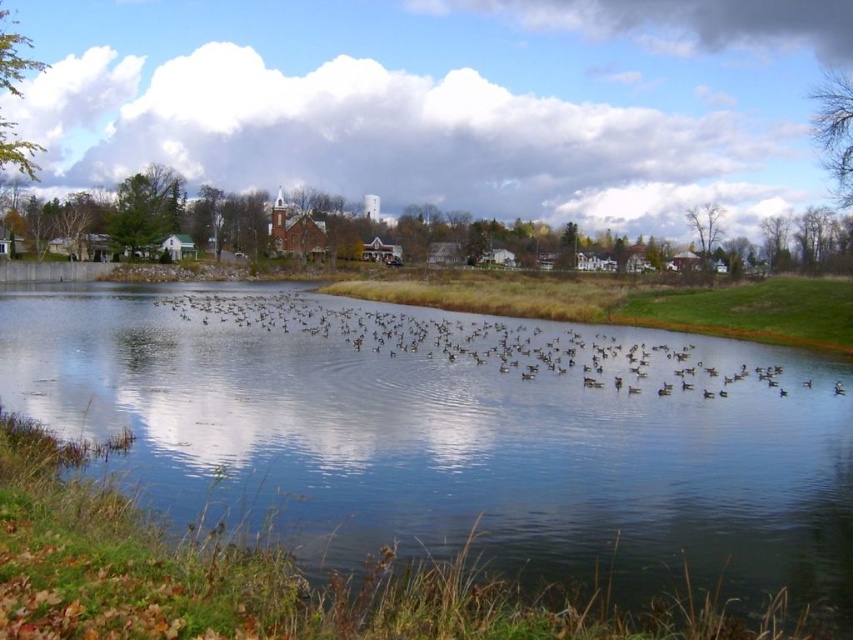
Question: Which point is farther to the camera?

Choices:
 (A) (779, 493)
 (B) (628, 362)

Answer: (B)

Question: Is clear water at center closer to camera compared to brown matte birds at center?

Choices:
 (A) yes
 (B) no

Answer: (A)

Question: Is clear water at center smaller than brown matte birds at center?

Choices:
 (A) no
 (B) yes

Answer: (B)

Question: Does clear water at center appear over brown matte birds at center?

Choices:
 (A) yes
 (B) no

Answer: (B)

Question: Which object is farther from the camera taking this photo?

Choices:
 (A) brown matte birds at center
 (B) clear water at center

Answer: (A)